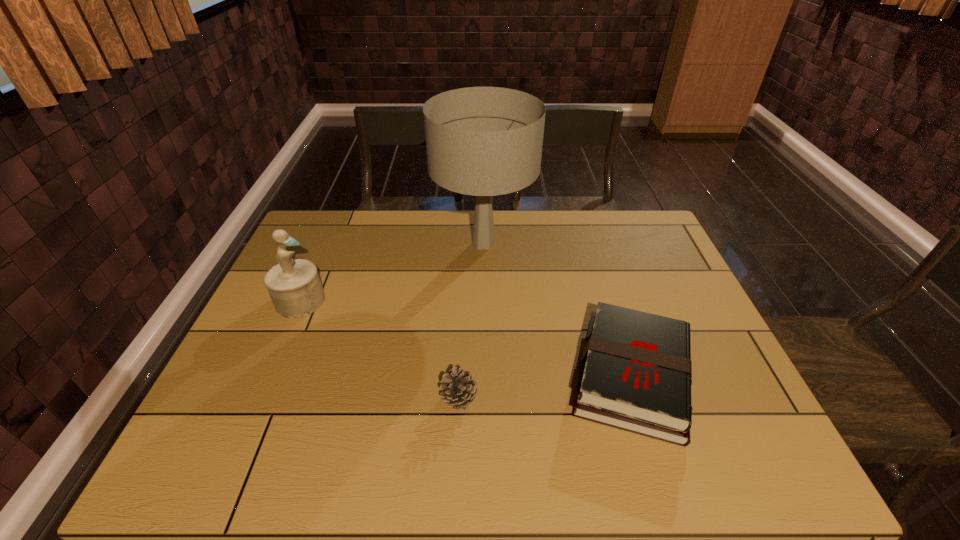
Identify the location of vacant area that satisfies the following two spatial constraints: 1. on the front-facing side of the hardback book; 2. on the left side of the tallest object. (485, 376).

This screenshot has width=960, height=540. Find the location of `vacant area that satisfies the following two spatial constraints: 1. at the beak of the third shortest object; 2. on the right side of the pinecone`. vacant area that satisfies the following two spatial constraints: 1. at the beak of the third shortest object; 2. on the right side of the pinecone is located at coordinates (257, 397).

The image size is (960, 540). I want to click on vacant position in the image that satisfies the following two spatial constraints: 1. at the beak of the leftmost object; 2. on the right side of the pinecone, so click(257, 397).

Identify the location of vacant space that satisfies the following two spatial constraints: 1. at the beak of the pinecone; 2. on the left side of the third nearest object. (257, 397).

I want to click on vacant space that satisfies the following two spatial constraints: 1. at the beak of the rightmost object; 2. on the right side of the third nearest object, so click(x=267, y=376).

This screenshot has width=960, height=540. Identify the location of vacant space that satisfies the following two spatial constraints: 1. at the beak of the third shortest object; 2. on the back side of the rightmost object. click(267, 376).

The image size is (960, 540). Identify the location of free spot that satisfies the following two spatial constraints: 1. at the beak of the pinecone; 2. on the right side of the second tallest object. (257, 397).